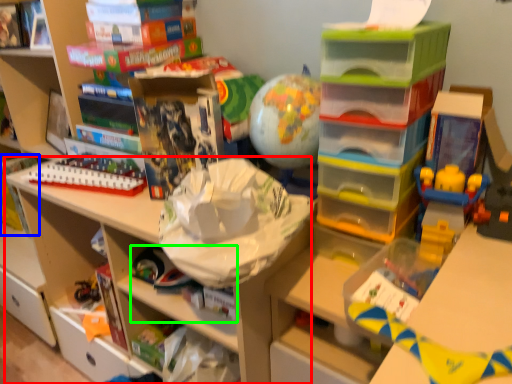
Question: Which is farther away from shelf (highlighted by a red box)? book (highlighted by a blue box) or book (highlighted by a green box)?

Choices:
 (A) book
 (B) book

Answer: (A)